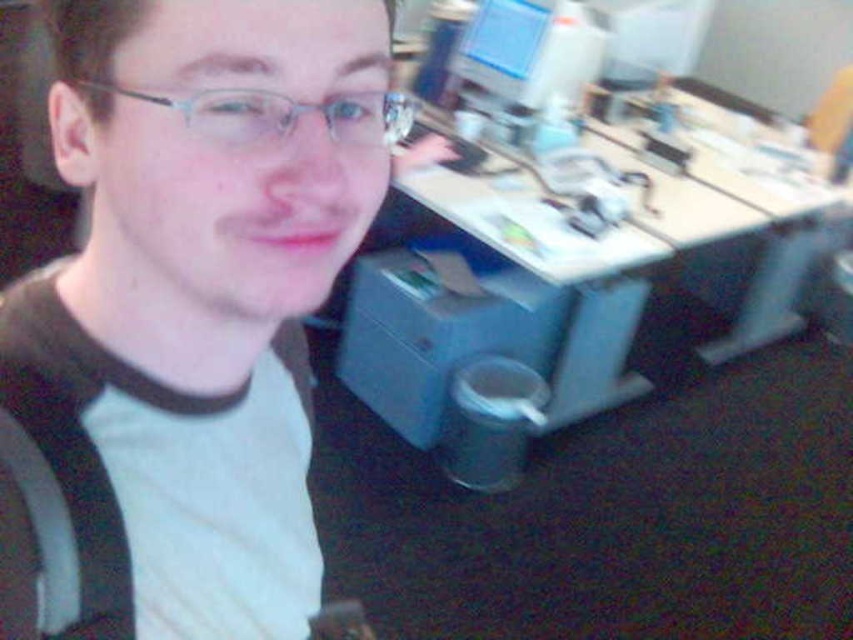
You are a delivery robot that is 1.5 meters tall. You need to deliver a package to the blue plastic computer desk at center. However, there are clear plastic glasses at upper center in your path. Can you safely pass under the glasses without knocking them over?

The distance between the blue plastic computer desk at center and the clear plastic glasses at upper center is 2.39 meters. Since the robot is 1.5 meters tall, it can safely pass under the glasses as the vertical clearance is sufficient.

Looking at the person in the image, which object, the matte black shirt at center or the clear plastic glasses at upper center, takes up more visual space?

The matte black shirt at center has a larger size compared to the clear plastic glasses at upper center, so it takes up more visual space.